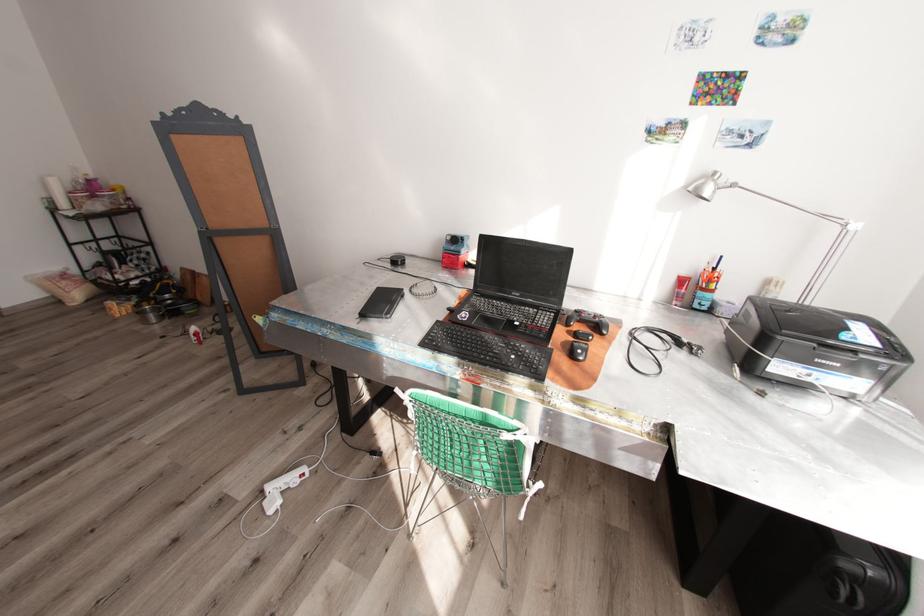
Locate an element on the screen. power strip switch is located at coordinates coord(772,286).